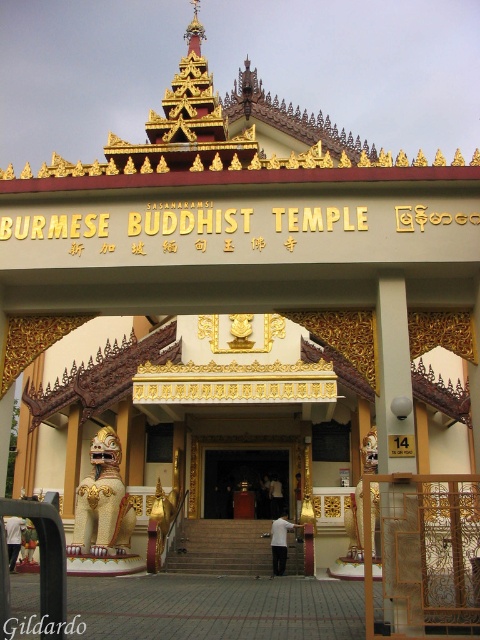
Question: Which point is closer to the camera?

Choices:
 (A) (243, 456)
 (B) (22, 636)

Answer: (B)

Question: Is the position of polished wood door at center less distant than that of blacktexturedwriting at center?

Choices:
 (A) no
 (B) yes

Answer: (A)

Question: Is polished wood door at center closer to camera compared to blacktexturedwriting at center?

Choices:
 (A) no
 (B) yes

Answer: (A)

Question: Is polished wood door at center above blacktexturedwriting at center?

Choices:
 (A) no
 (B) yes

Answer: (A)

Question: Which point is farther to the camera?

Choices:
 (A) blacktexturedwriting at center
 (B) polished wood door at center

Answer: (B)